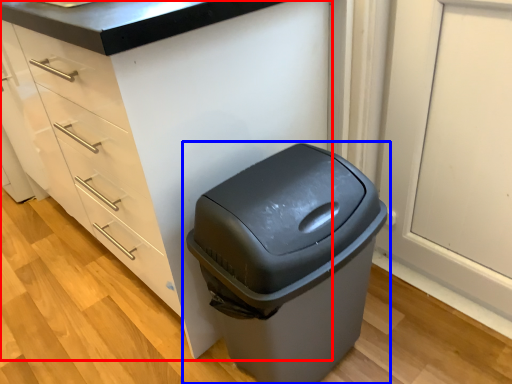
Question: Which object appears closest to the camera in this image, cabinetry (highlighted by a red box) or waste container (highlighted by a blue box)?

Choices:
 (A) cabinetry
 (B) waste container

Answer: (A)